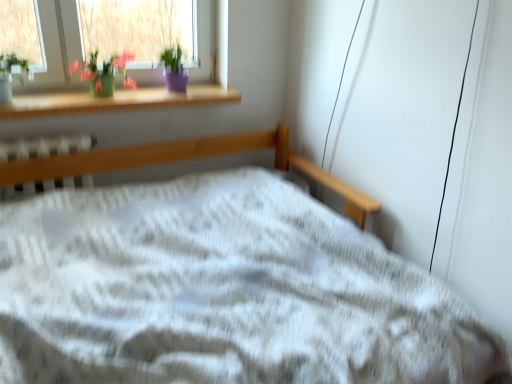
I want to click on free point to the left of green matte vase at upper left, so (x=58, y=100).